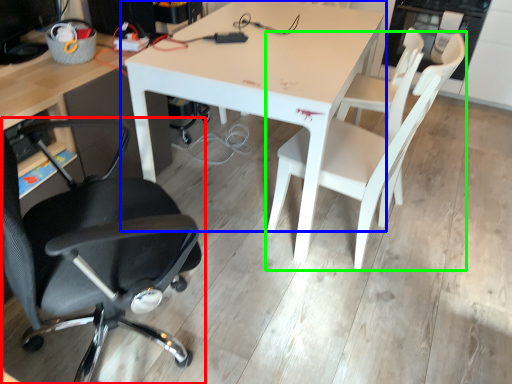
Question: Estimate the real-world distances between objects in this image. Which object is closer to chair (highlighted by a red box), table (highlighted by a blue box) or chair (highlighted by a green box)?

Choices:
 (A) table
 (B) chair

Answer: (A)